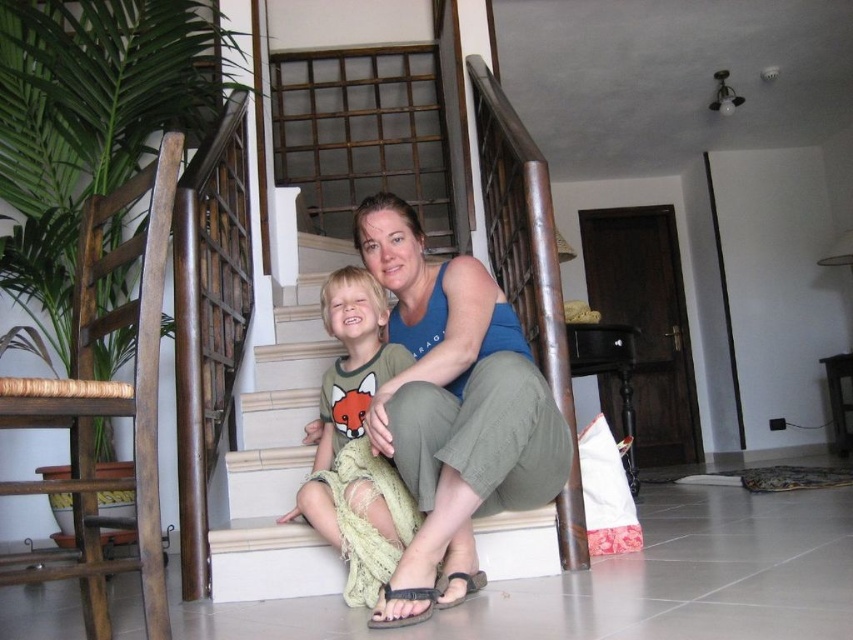
Who is lower down, white concrete stairs at center or brown leather sandal at lower center?

brown leather sandal at lower center

Can you confirm if white concrete stairs at center is taller than brown leather sandal at lower center?

Yes, white concrete stairs at center is taller than brown leather sandal at lower center.

Does point (317, 346) come closer to viewer compared to point (477, 572)?

No, (317, 346) is behind (477, 572).

At what (x,y) coordinates should I click in order to perform the action: click on white concrete stairs at center. Please return your answer as a coordinate pair (x, y). The height and width of the screenshot is (640, 853). Looking at the image, I should click on (279, 451).

Between white concrete stairs at center and black fabric sandal at lower center, which one has less height?

black fabric sandal at lower center is shorter.

Between white concrete stairs at center and black fabric sandal at lower center, which one appears on the left side from the viewer's perspective?

white concrete stairs at center is more to the left.

Does point (311, 273) lie behind point (416, 596)?

Yes, it is behind point (416, 596).

I want to click on white concrete stairs at center, so click(x=279, y=451).

Does black fabric sandal at lower center appear under brown leather sandal at lower center?

No, black fabric sandal at lower center is not below brown leather sandal at lower center.

Is point (416, 598) in front of point (454, 600)?

That is True.

Find the location of a particular element. black fabric sandal at lower center is located at coordinates (405, 600).